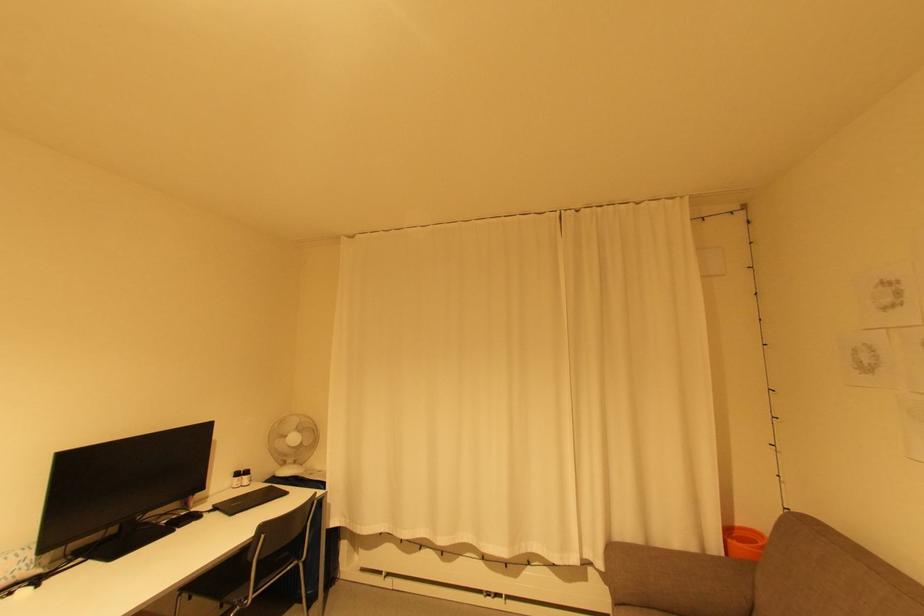
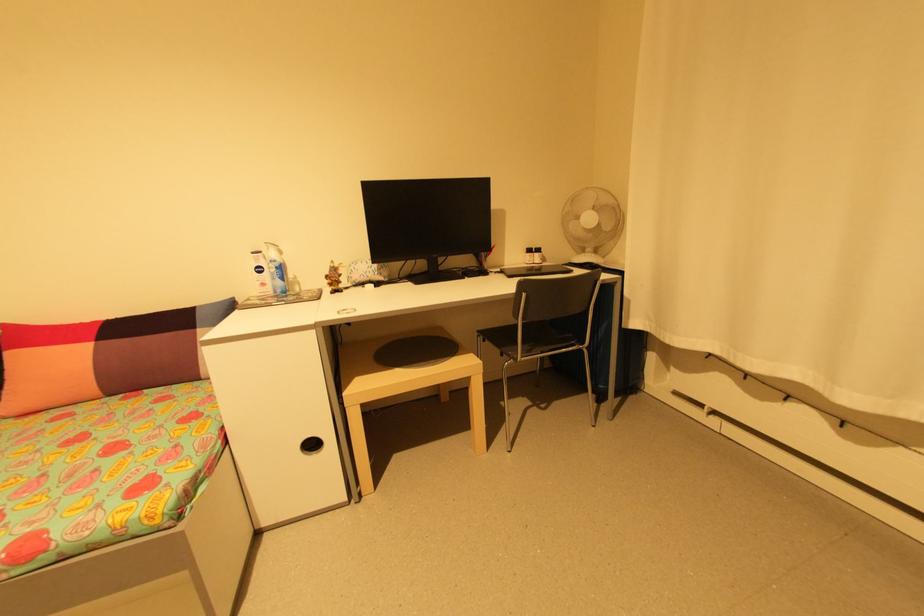
Where in the second image is the point corresponding to the point at 300,462 from the first image?

(600, 252)